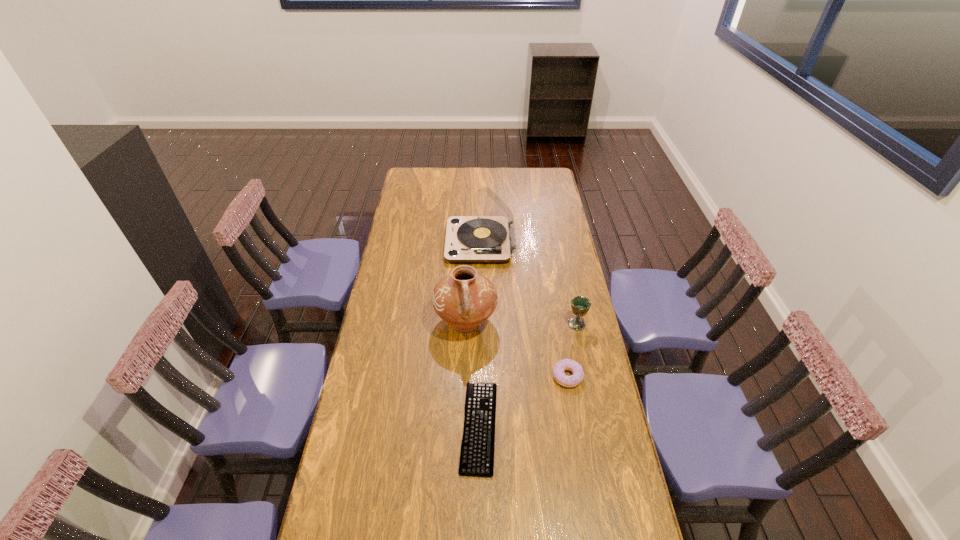
Locate an element on the screen. The width and height of the screenshot is (960, 540). pottery is located at coordinates (464, 299).

Identify the location of record player. The height and width of the screenshot is (540, 960). (489, 237).

Image resolution: width=960 pixels, height=540 pixels. In order to click on the third shortest object in this screenshot , I will do `click(580, 305)`.

The width and height of the screenshot is (960, 540). What are the coordinates of `doughnut` in the screenshot? It's located at (566, 364).

I want to click on computer keyboard, so [478, 441].

In order to click on vacant space located 0.320m on the side of the pottery with the handle in this screenshot , I will do `click(463, 423)`.

The image size is (960, 540). I want to click on vacant space located with the tonearm facing the front of the record player, so click(420, 243).

Image resolution: width=960 pixels, height=540 pixels. I want to click on vacant space located with the tonearm facing the front of the record player, so click(x=396, y=243).

The image size is (960, 540). I want to click on free space located with the tonearm facing the front of the record player, so click(404, 243).

What are the coordinates of `vacant space situated on the front of the chalice` in the screenshot? It's located at (583, 351).